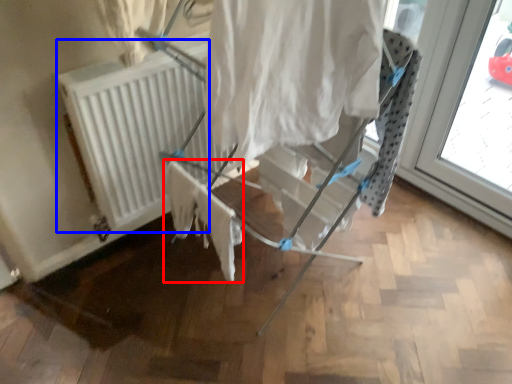
Question: Which point is further to the camera, fabric (highlighted by a red box) or radiator (highlighted by a blue box)?

Choices:
 (A) fabric
 (B) radiator

Answer: (B)